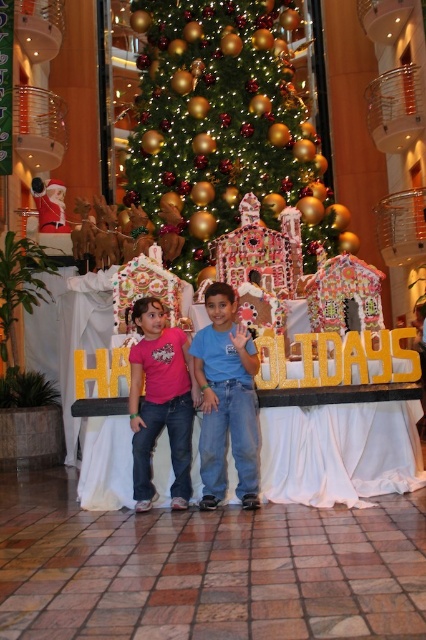
You are standing in front of the holiday display and need to place a gift under the Christmas tree. The gift must be placed exactly at the coordinates given for the blue jeans at center. Where should you place the gift relative to the Christmas tree?

A: The gift should be placed at the coordinates point (227, 401), which is the location of the blue jeans at center relative to the Christmas tree.

You are standing in front of the Christmas tree and see the blue jeans at center and the pink matte shirt at center. Which item is nearer to you?

The blue jeans at center is closer to the viewer than the pink matte shirt at center, so the blue jeans at center is nearer to you.

You are a photographer trying to capture a photo of the green shiny christmas tree at center and the blue jeans at center. Since you want both subjects to be in focus, you need to know which one is wider. Which object is wider?

The green shiny christmas tree at center is wider than the blue jeans at center, so you should focus on the tree to ensure both are in focus.